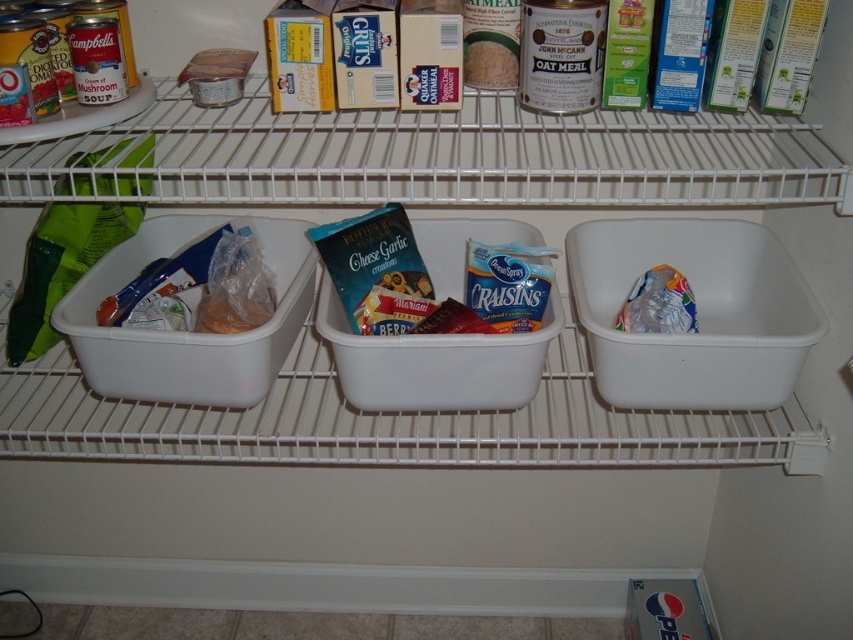
In the scene shown: You are organizing the pantry and need to place a new item on the shelf. Where exactly is the translucent plastic bag at center right located in the pantry?

The translucent plastic bag at center right is located at point (659, 304) in the pantry.

In the scene shown: You are organizing the pantry and need to place a new item that requires more vertical space. Which item between the translucent plastic bag at center right and the smooth white rice at center has more height to accommodate it?

The translucent plastic bag at center right has a greater height compared to the smooth white rice at center, so it can accommodate items requiring more vertical space.

You are organizing a pantry and need to place a 12 inch long container between the translucent plastic bag at center right and the smooth white rice at center. Can you fit it there?

The distance between the translucent plastic bag at center right and smooth white rice at center is 12.88 inches, so the 12 inch container can fit with a small amount of space remaining.